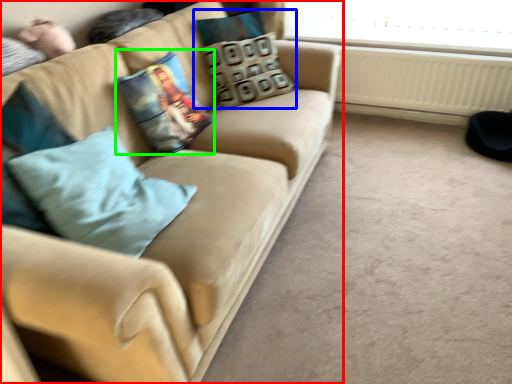
Question: Which object is the farthest from studio couch (highlighted by a red box)? Choose among these: pillow (highlighted by a blue box) or pillow (highlighted by a green box).

Choices:
 (A) pillow
 (B) pillow

Answer: (A)